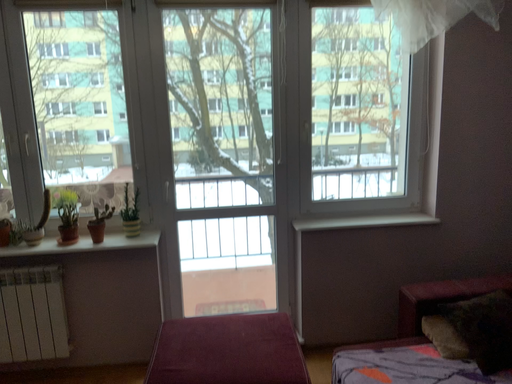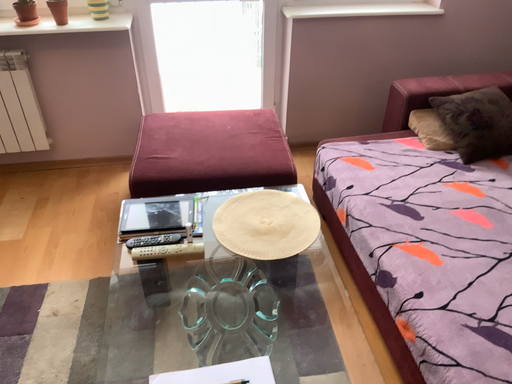
Question: Which way did the camera rotate in the video?

Choices:
 (A) rotated downward
 (B) rotated upward

Answer: (A)